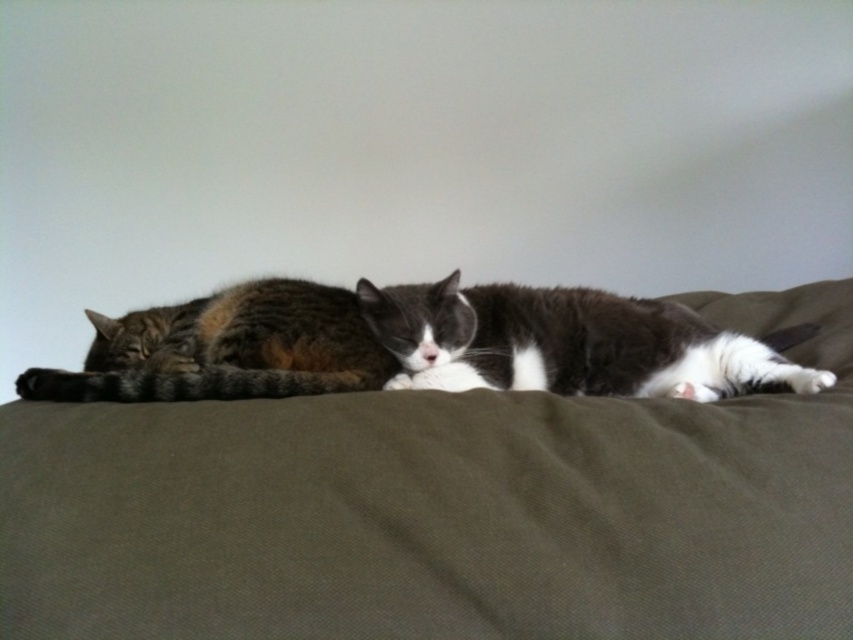
From the picture: You are standing in front of a picture of two cats resting on a dark green fabric. There is a point marked at coordinates point (318, 433). If you want to touch this point with a ruler that is 25 inches long, will the ruler reach the point?

The distance of point (318, 433) from viewer is 26.23 inches, so the ruler that is 25 inches long will not reach the point.